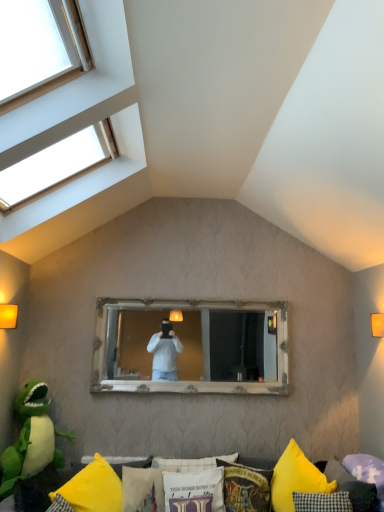
Question: Is clear glass window at upper left not inside white fabric pillow at lower center, arranged as the third pillow when viewed from the right?

Choices:
 (A) no
 (B) yes

Answer: (B)

Question: Can you confirm if clear glass window at upper left is wider than white fabric pillow at lower center, the third pillow positioned from the left?

Choices:
 (A) no
 (B) yes

Answer: (B)

Question: Can you confirm if clear glass window at upper left is shorter than white fabric pillow at lower center, the third pillow positioned from the left?

Choices:
 (A) yes
 (B) no

Answer: (B)

Question: Is clear glass window at upper left to the right of white fabric pillow at lower center, arranged as the third pillow when viewed from the right, from the viewer's perspective?

Choices:
 (A) no
 (B) yes

Answer: (A)

Question: From the image's perspective, would you say clear glass window at upper left is shown under white fabric pillow at lower center, the third pillow positioned from the left?

Choices:
 (A) no
 (B) yes

Answer: (A)

Question: Considering the positions of white fabric pillow at lower center, arranged as the third pillow when viewed from the right, and harry potter-themed fabric pillow at lower center, which is the 2th pillow from right to left, in the image, is white fabric pillow at lower center, arranged as the third pillow when viewed from the right, bigger or smaller than harry potter-themed fabric pillow at lower center, which is the 2th pillow from right to left,?

Choices:
 (A) big
 (B) small

Answer: (A)

Question: Considering their positions, is white fabric pillow at lower center, the third pillow positioned from the left, located in front of or behind harry potter-themed fabric pillow at lower center, which is the 2th pillow from right to left?

Choices:
 (A) front
 (B) behind

Answer: (B)

Question: Would you say white fabric pillow at lower center, the third pillow positioned from the left, is inside or outside harry potter-themed fabric pillow at lower center, acting as the fourth pillow starting from the left?

Choices:
 (A) inside
 (B) outside

Answer: (B)

Question: From a real-world perspective, is white fabric pillow at lower center, arranged as the third pillow when viewed from the right, above or below harry potter-themed fabric pillow at lower center, acting as the fourth pillow starting from the left?

Choices:
 (A) below
 (B) above

Answer: (B)

Question: In terms of width, does white wooden mirror at center look wider or thinner when compared to purple fabric pillow at lower right, which is the 5th pillow from left to right?

Choices:
 (A) wide
 (B) thin

Answer: (B)

Question: Is white wooden mirror at center in front of or behind purple fabric pillow at lower right, which ranks as the first pillow in right-to-left order, in the image?

Choices:
 (A) front
 (B) behind

Answer: (B)

Question: From a real-world perspective, is white wooden mirror at center physically located above or below purple fabric pillow at lower right, which is the 5th pillow from left to right?

Choices:
 (A) below
 (B) above

Answer: (B)

Question: From their relative heights in the image, would you say white wooden mirror at center is taller or shorter than purple fabric pillow at lower right, which ranks as the first pillow in right-to-left order?

Choices:
 (A) tall
 (B) short

Answer: (A)

Question: Is yellow fabric cushion at lower center bigger or smaller than green plush toy at lower left?

Choices:
 (A) big
 (B) small

Answer: (A)

Question: Is yellow fabric cushion at lower center wider or thinner than green plush toy at lower left?

Choices:
 (A) wide
 (B) thin

Answer: (A)